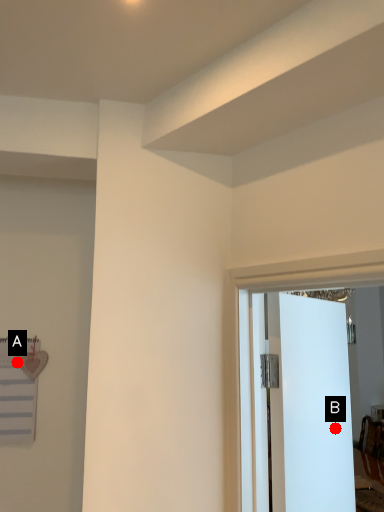
Question: Two points are circled on the image, labeled by A and B beside each circle. Which point is closer to the camera?

Choices:
 (A) A is closer
 (B) B is closer

Answer: (A)